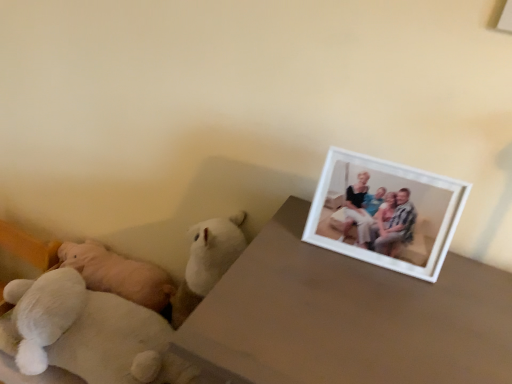
Question: Is white plush teddy bear at lower left, the first teddy bear when ordered from right to left, directly adjacent to white matte picture frame at upper right?

Choices:
 (A) no
 (B) yes

Answer: (A)

Question: From a real-world perspective, is white plush teddy bear at lower left, which is the 2th teddy bear in left-to-right order, positioned under white matte picture frame at upper right based on gravity?

Choices:
 (A) no
 (B) yes

Answer: (B)

Question: Is white plush teddy bear at lower left, the first teddy bear viewed from the front, at the left side of white matte picture frame at upper right?

Choices:
 (A) no
 (B) yes

Answer: (B)

Question: Can you confirm if white plush teddy bear at lower left, the second teddy bear positioned from the back, is taller than white matte picture frame at upper right?

Choices:
 (A) no
 (B) yes

Answer: (A)

Question: Is white plush teddy bear at lower left, which is the 2th teddy bear in left-to-right order, not within white matte picture frame at upper right?

Choices:
 (A) no
 (B) yes

Answer: (B)

Question: From their relative heights in the image, would you say white plush teddy bear at left, marked as the first teddy bear in a back-to-front arrangement, is taller or shorter than white matte table at upper right?

Choices:
 (A) short
 (B) tall

Answer: (A)

Question: Visually, is white plush teddy bear at left, which appears as the second teddy bear when viewed from the right, positioned to the left or to the right of white matte table at upper right?

Choices:
 (A) right
 (B) left

Answer: (B)

Question: In terms of size, does white plush teddy bear at left, which ranks as the 1th teddy bear in left-to-right order, appear bigger or smaller than white matte table at upper right?

Choices:
 (A) big
 (B) small

Answer: (B)

Question: From a real-world perspective, relative to white matte table at upper right, is white plush teddy bear at left, marked as the first teddy bear in a back-to-front arrangement, vertically above or below?

Choices:
 (A) below
 (B) above

Answer: (A)

Question: Looking at their shapes, would you say white matte picture frame at upper right is wider or thinner than white matte table at upper right?

Choices:
 (A) wide
 (B) thin

Answer: (B)

Question: From a real-world perspective, is white matte picture frame at upper right positioned above or below white matte table at upper right?

Choices:
 (A) above
 (B) below

Answer: (A)

Question: In the image, is white matte picture frame at upper right on the left side or the right side of white matte table at upper right?

Choices:
 (A) left
 (B) right

Answer: (B)

Question: Is white matte picture frame at upper right inside or outside of white matte table at upper right?

Choices:
 (A) outside
 (B) inside

Answer: (A)

Question: Looking at their shapes, would you say white matte table at upper right is wider or thinner than white matte picture frame at upper right?

Choices:
 (A) wide
 (B) thin

Answer: (A)

Question: Looking at the image, does white matte table at upper right seem bigger or smaller compared to white matte picture frame at upper right?

Choices:
 (A) big
 (B) small

Answer: (A)